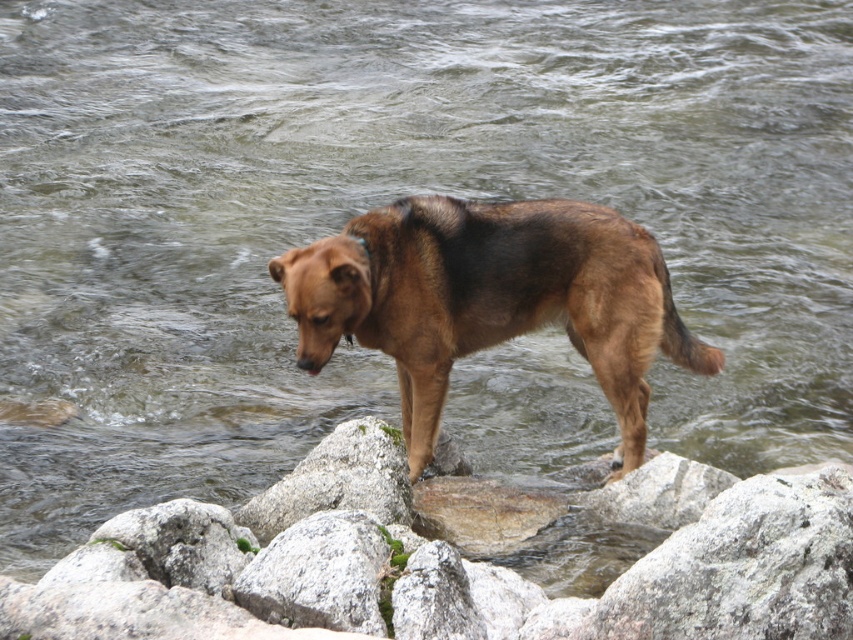
You are a hiker who has a backpack with a 3 meter long rope. You are standing on the gray rock at center and want to reach the other side of the turbulent water. Can you use the rope to safely cross the water?

The distance between the gray rock at center and the other side is 2.51 meters. Since the rope is 3 meters long, it is long enough to safely cross the water.

You are a photographer trying to capture the dog in the image. You want to place the dog exactly at the center of your photo. Given that the gray rock at center is located at point 0.880, 0.529 in the image coordinates, how far horizontally should you move the camera to the left or right to center the dog?

The gray rock at center is located at point (450, 563). To center the dog, you need to adjust the camera so that the dog aligns with the image center coordinates. However, the question does not provide the dog or gray rock at center coordinates relative to the image center, so it is impossible to determine the exact horizontal movement required.

You are a photographer trying to capture the dog in the image. The gray rock at center is where you want to place the dog in your shot using the rule of thirds. Is the point you marked at point (450, 563) the correct location for the gray rock at center?

Yes, the gray rock at center is represented by point (450, 563), so the marked point is correct for placing the dog according to the rule of thirds.